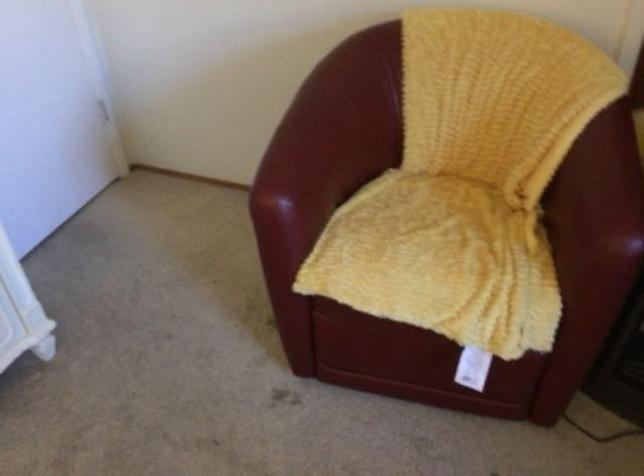
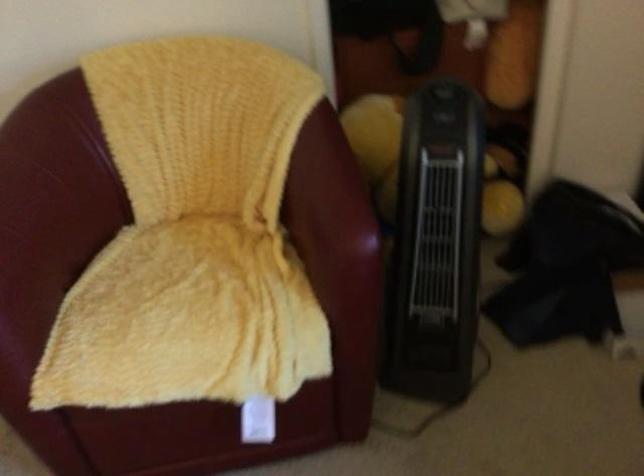
In a continuous first-person perspective shot, in which direction is the camera moving?

The cameraman walked toward right, forward.